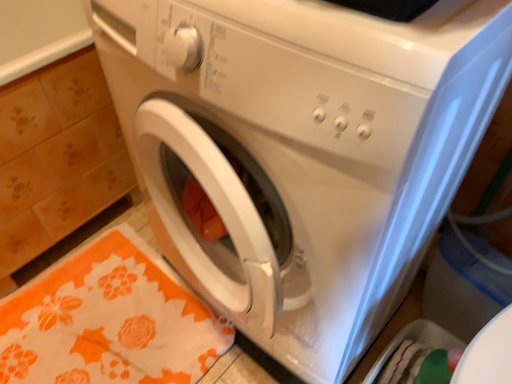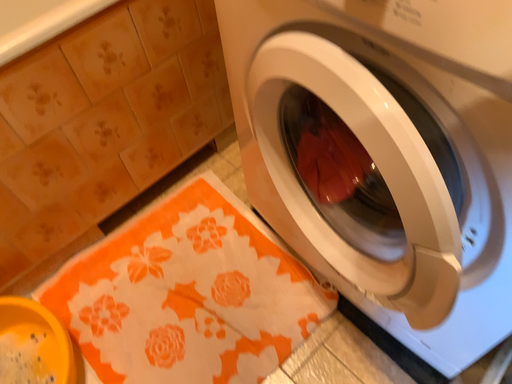
Question: How did the camera likely rotate when shooting the video?

Choices:
 (A) rotated upward
 (B) rotated downward

Answer: (B)